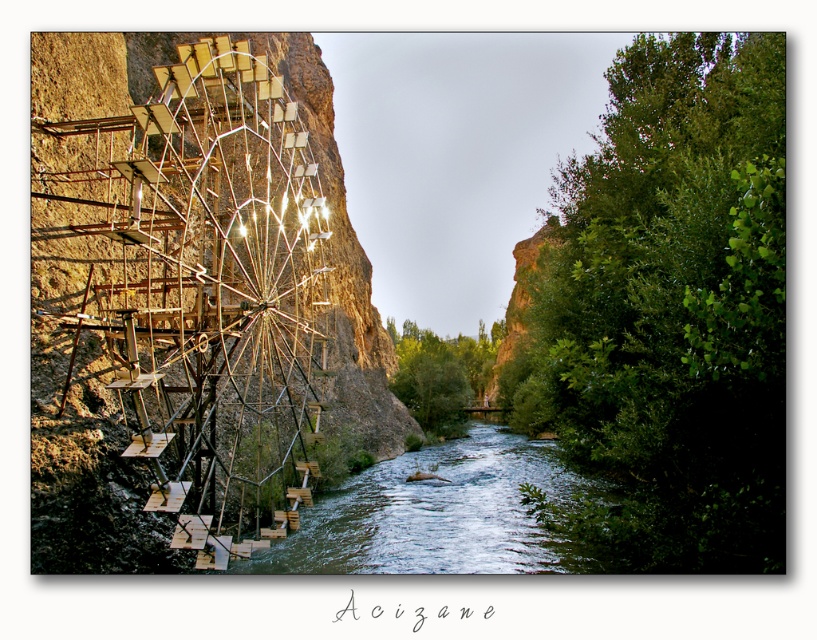
Is point (103, 403) in front of point (512, 454)?

That is True.

How distant is metallic ferris wheel at left from greenish water at center?

A distance of 21.30 meters exists between metallic ferris wheel at left and greenish water at center.

Does point (117, 266) lie behind point (514, 465)?

No, (117, 266) is in front of (514, 465).

Where is `metallic ferris wheel at left`? Image resolution: width=817 pixels, height=640 pixels. metallic ferris wheel at left is located at coordinates (199, 282).